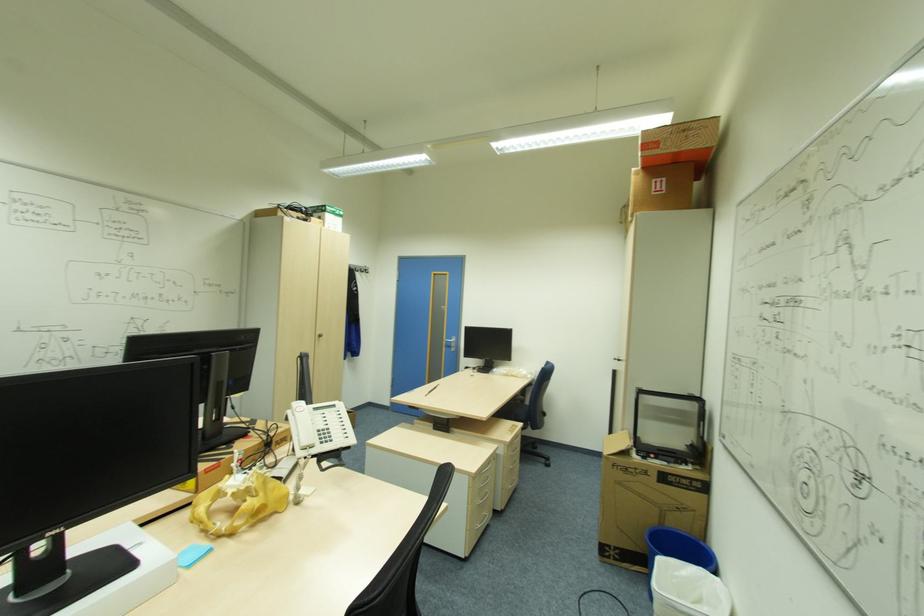
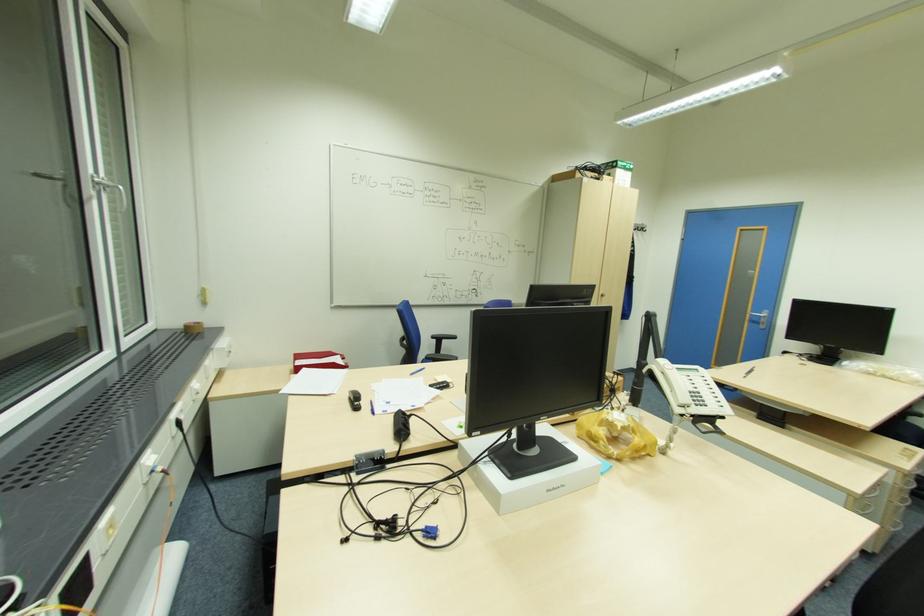
Locate, in the second image, the point that corresponds to (x=456, y=346) in the first image.

(766, 323)